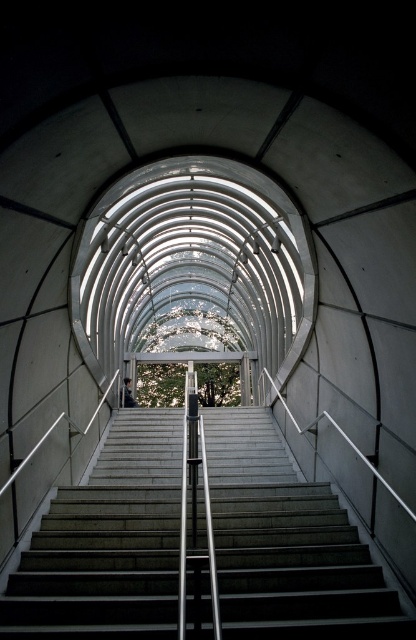
You are standing at the bottom of the concrete stairs at center and want to reach the dark gray fabric jacket at center. Which direction should you move to get closer to the jacket?

The concrete stairs at center is in front of the dark gray fabric jacket at center, so to reach the jacket, you should move backward away from the stairs towards the jacket.

You are a delivery person carrying a large box that is as wide as the concrete stairs at center. You need to pass through an area where there is a dark gray fabric jacket at center. Can your box fit through the space where the jacket is located?

The concrete stairs at center are wider than the dark gray fabric jacket at center. Since your box is as wide as the stairs, it may not fit through the space where the jacket is located because the jacket area is narrower than the stairs.

You are standing at the base of the concrete stairs at center and want to walk up to the bright open area at the top. If your average walking speed is 1.2 meters per second, how many seconds will it take you to reach the top?

The concrete stairs at center is 5.40 meters from camera. At a walking speed of 1.2 meters per second, it would take 5.40 divided by 1.2 equals 4.5 seconds to reach the top.